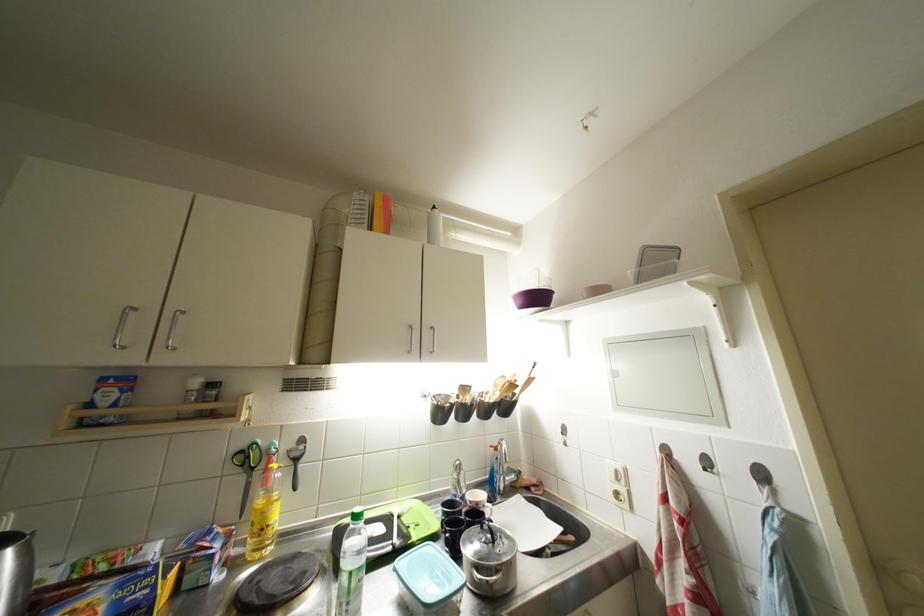
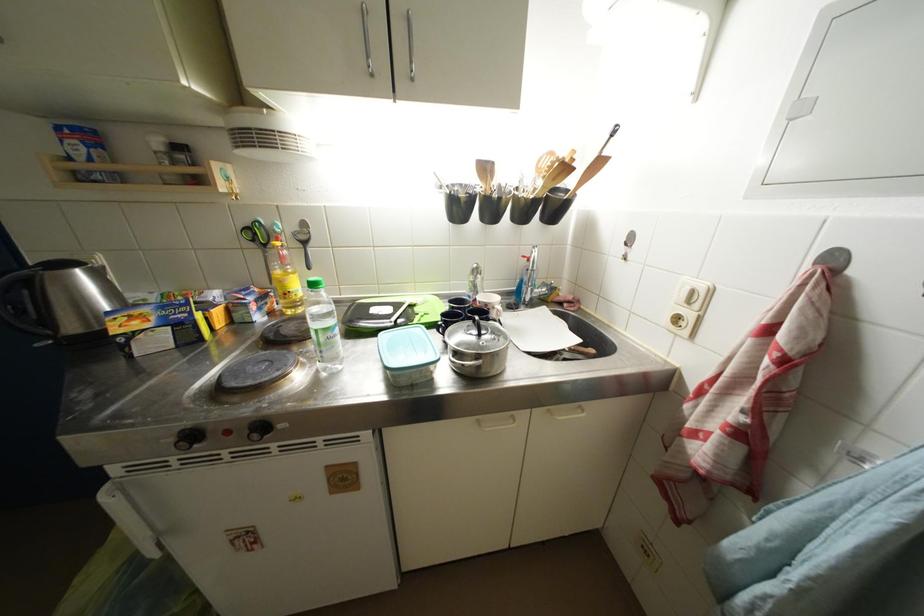
Find the pixel in the second image that matches point (260, 472) in the first image.

(272, 249)